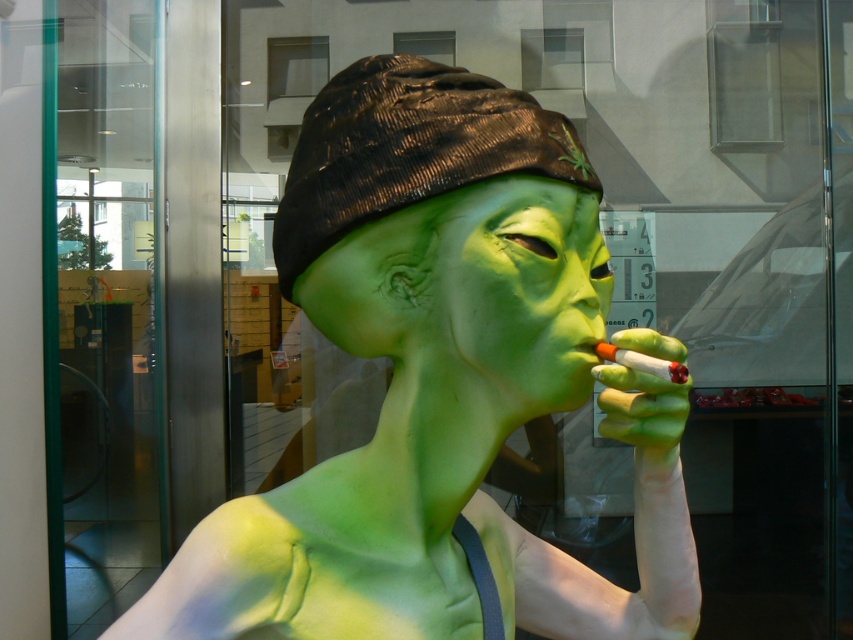
Is matte green alien at center above transparent glass door at left?

Correct, matte green alien at center is located above transparent glass door at left.

Is point (474, 284) less distant than point (73, 468)?

Yes, point (474, 284) is in front of point (73, 468).

Locate an element on the screen. matte green alien at center is located at coordinates (439, 381).

Who is positioned more to the right, black textured beanie at upper center or green matte mask at center?

green matte mask at center

Consider the image. Is black textured beanie at upper center wider than green matte mask at center?

Yes, black textured beanie at upper center is wider than green matte mask at center.

You are a GUI agent. You are given a task and a screenshot of the screen. Output one action in this format:
    pyautogui.click(x=<x>, y=<y>)
    Task: Click on the black textured beanie at upper center
    
    Given the screenshot: What is the action you would take?
    pyautogui.click(x=408, y=148)

Locate an element on the screen. The height and width of the screenshot is (640, 853). black textured beanie at upper center is located at coordinates (408, 148).

How distant is transparent glass door at left from black textured beanie at upper center?

transparent glass door at left is 6.27 feet from black textured beanie at upper center.

Can you confirm if transparent glass door at left is positioned to the left of black textured beanie at upper center?

Indeed, transparent glass door at left is positioned on the left side of black textured beanie at upper center.

Does point (141, 292) come farther from viewer compared to point (326, 154)?

Yes, point (141, 292) is behind point (326, 154).

The image size is (853, 640). What are the coordinates of `transparent glass door at left` in the screenshot? It's located at (102, 305).